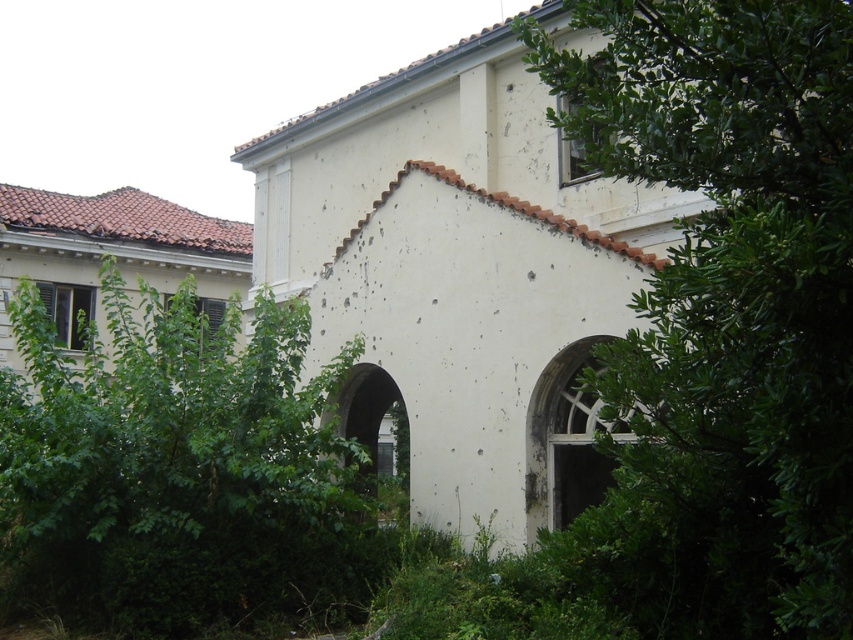
Is point (763, 492) less distant than point (270, 428)?

Yes, it is in front of point (270, 428).

Between green leafy tree at center right and green leafy bush at lower left, which one appears on the right side from the viewer's perspective?

green leafy tree at center right

Find the location of a particular element. green leafy tree at center right is located at coordinates (724, 314).

Which is behind, point (160, 321) or point (396, 426)?

The point (396, 426) is more distant.

Does green leafy bush at lower left have a larger size compared to white stone archway at center?

Yes, green leafy bush at lower left is bigger than white stone archway at center.

What do you see at coordinates (178, 470) in the screenshot? Image resolution: width=853 pixels, height=640 pixels. I see `green leafy bush at lower left` at bounding box center [178, 470].

Locate an element on the screen. This screenshot has width=853, height=640. green leafy bush at lower left is located at coordinates (178, 470).

Which of these two, green leafy tree at center right or white stone archway at center, stands taller?

With more height is white stone archway at center.

Who is more forward, (688, 275) or (349, 372)?

Point (688, 275)

Identify the location of green leafy tree at center right. (724, 314).